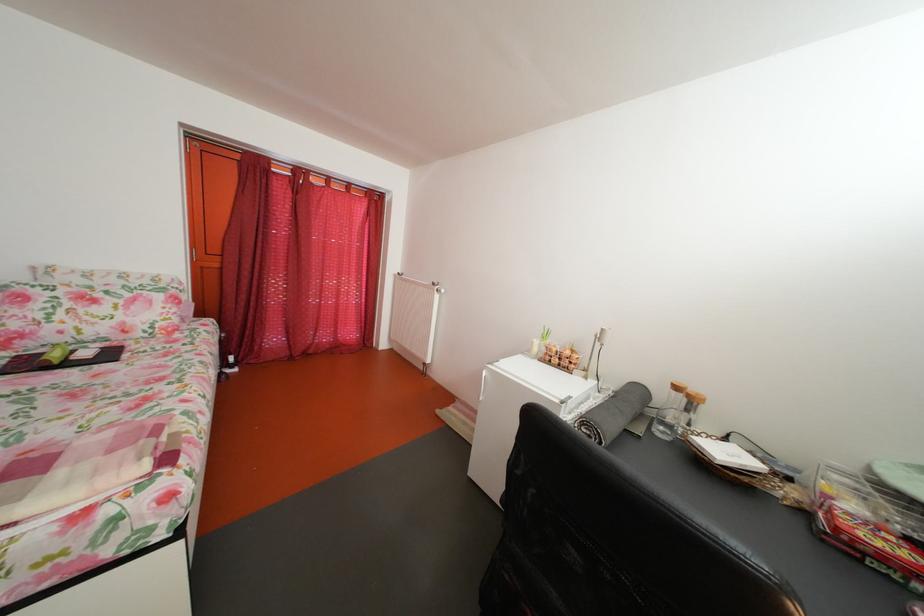
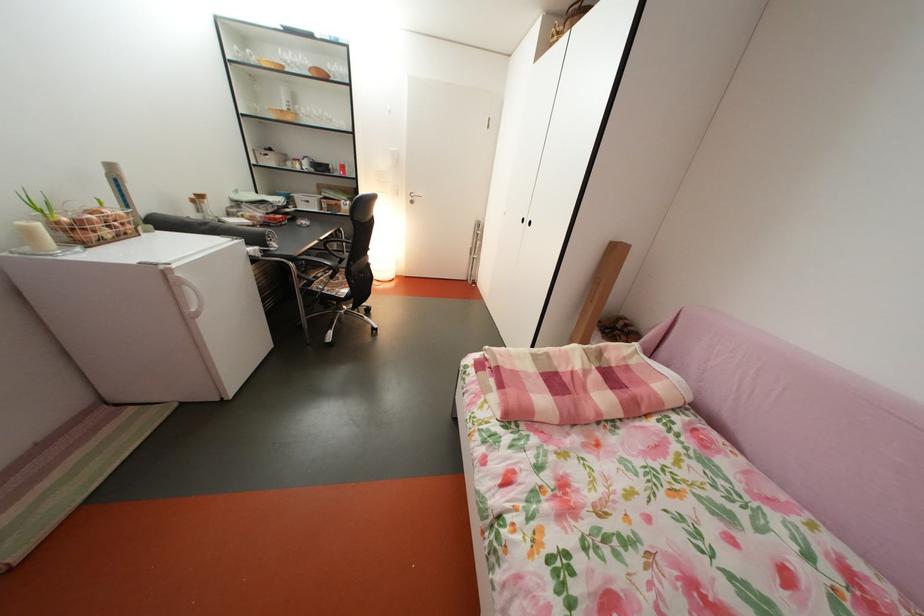
Where in the second image is the point corresponding to the point at 543,350 from the first image?

(41, 238)